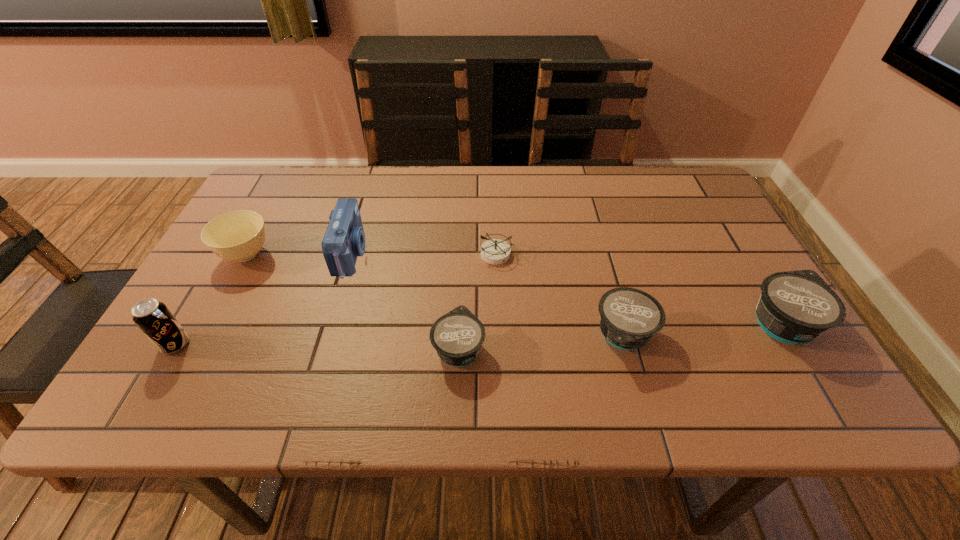
Where is `object situated at the near right corner`? object situated at the near right corner is located at coordinates (794, 307).

The image size is (960, 540). Find the location of `vacant space at the far edge of the desktop`. vacant space at the far edge of the desktop is located at coordinates (557, 169).

I want to click on free region at the near edge of the desktop, so click(335, 342).

At what (x,y) coordinates should I click in order to perform the action: click on vacant space at the left edge of the desktop. Please return your answer as a coordinate pair (x, y). Looking at the image, I should click on tap(243, 331).

Image resolution: width=960 pixels, height=540 pixels. In the image, there is a desktop. In order to click on free space at the right edge in this screenshot , I will do `click(742, 311)`.

Where is `vacant area at the far right corner`? The image size is (960, 540). vacant area at the far right corner is located at coordinates (663, 195).

The image size is (960, 540). I want to click on free spot between the soda can and the compass, so click(336, 299).

This screenshot has height=540, width=960. I want to click on blank region between the sugar bowl and the leftmost yogurt, so point(352,301).

Locate an element on the screen. The image size is (960, 540). free spot between the fifth tallest object and the fifth object from right to left is located at coordinates (488, 294).

Image resolution: width=960 pixels, height=540 pixels. I want to click on empty space that is in between the second object from right to left and the soda can, so click(x=399, y=340).